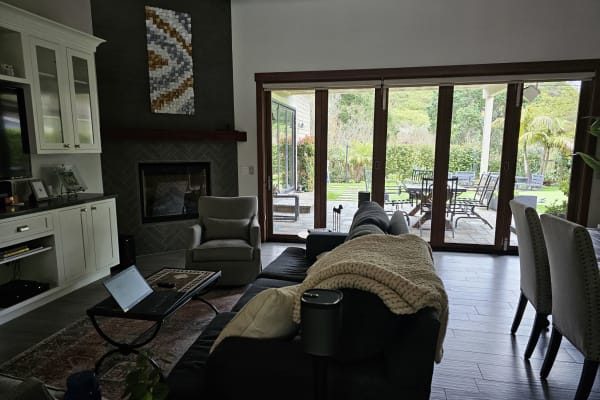
This screenshot has width=600, height=400. Find the location of `picture frame`. picture frame is located at coordinates (39, 191).